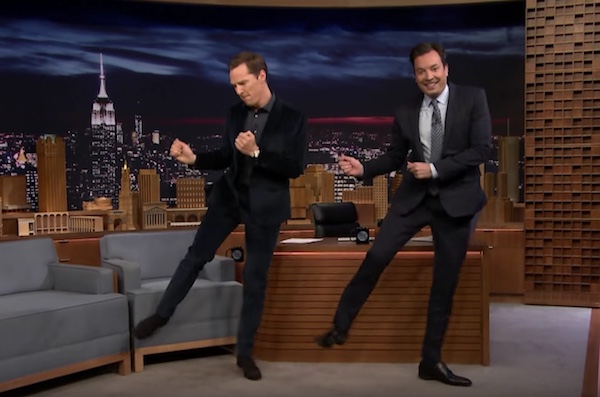
At what (x,y) coordinates should I click in order to perform the action: click on black mug. Please return your answer as a coordinate pair (x, y). This screenshot has height=397, width=600. Looking at the image, I should click on coord(239,250), coord(363,232).